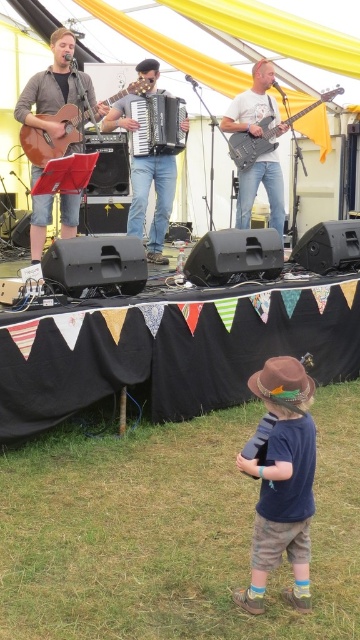
Can you confirm if matte black accordion at center is shorter than matte brown acoustic guitar at left?

Correct, matte black accordion at center is not as tall as matte brown acoustic guitar at left.

What do you see at coordinates (155, 198) in the screenshot?
I see `matte black accordion at center` at bounding box center [155, 198].

Where is `matte black accordion at center`? The width and height of the screenshot is (360, 640). matte black accordion at center is located at coordinates (155, 198).

Find the location of a particular element. The height and width of the screenshot is (640, 360). brown felt hat at lower center is located at coordinates (282, 483).

Can you confirm if brown felt hat at lower center is thinner than matte brown guitar at left?

Yes.

Is point (270, 476) positioned before point (61, 49)?

That is True.

At what (x,y) coordinates should I click in order to perform the action: click on brown felt hat at lower center. Please return your answer as a coordinate pair (x, y). Looking at the image, I should click on (282, 483).

Which is below, black matte accordion at center or brown felt cowboy hat at lower center?

brown felt cowboy hat at lower center is lower down.

Who is shorter, black matte accordion at center or brown felt cowboy hat at lower center?

brown felt cowboy hat at lower center is shorter.

The image size is (360, 640). What do you see at coordinates (158, 124) in the screenshot?
I see `black matte accordion at center` at bounding box center [158, 124].

This screenshot has width=360, height=640. What are the coordinates of `black matte accordion at center` in the screenshot? It's located at (158, 124).